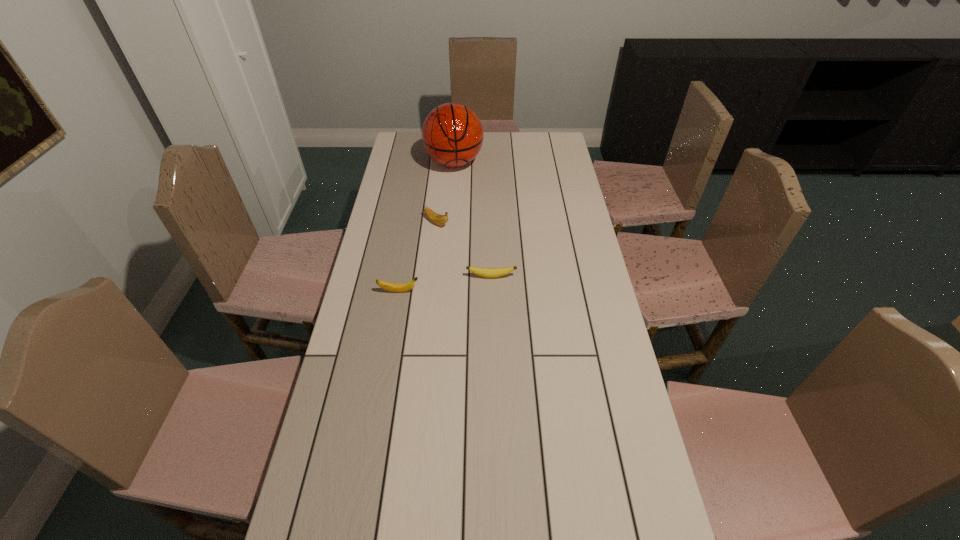
Identify which banana is located as the second nearest to the basketball. Please provide its 2D coordinates. Your answer should be formatted as a tuple, i.e. [(x, y)], where the tuple contains the x and y coordinates of a point satisfying the conditions above.

[(485, 272)]

Identify which banana is the second closest to the farthest object. Please provide its 2D coordinates. Your answer should be formatted as a tuple, i.e. [(x, y)], where the tuple contains the x and y coordinates of a point satisfying the conditions above.

[(485, 272)]

At what (x,y) coordinates should I click in order to perform the action: click on free spot that satisfies the following two spatial constraints: 1. on the front side of the second nearest banana; 2. on the left side of the farthest banana. Please return your answer as a coordinate pair (x, y). Looking at the image, I should click on (431, 276).

You are a GUI agent. You are given a task and a screenshot of the screen. Output one action in this format:
    pyautogui.click(x=<x>, y=<y>)
    Task: Click on the free space that satisfies the following two spatial constraints: 1. on the side with spill of the tallest object; 2. on the left side of the second nearest object
    This screenshot has height=540, width=960.
    Given the screenshot: What is the action you would take?
    pyautogui.click(x=445, y=276)

In order to click on free space that satisfies the following two spatial constraints: 1. on the side with spill of the basketball; 2. on the left side of the rightmost banana in this screenshot , I will do `click(445, 276)`.

Find the location of a particular element. free space in the image that satisfies the following two spatial constraints: 1. on the side with spill of the shortest banana; 2. on the right side of the farthest object is located at coordinates (445, 276).